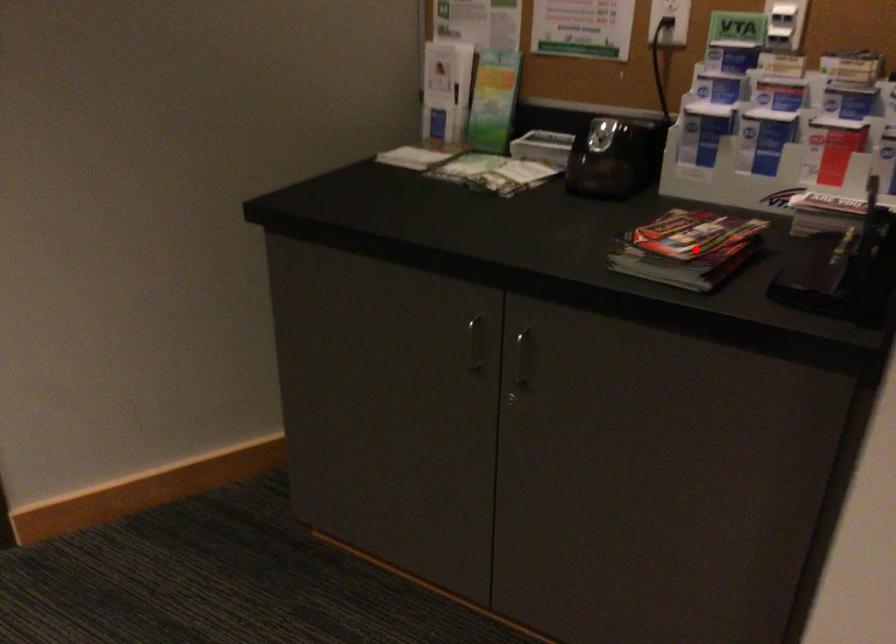
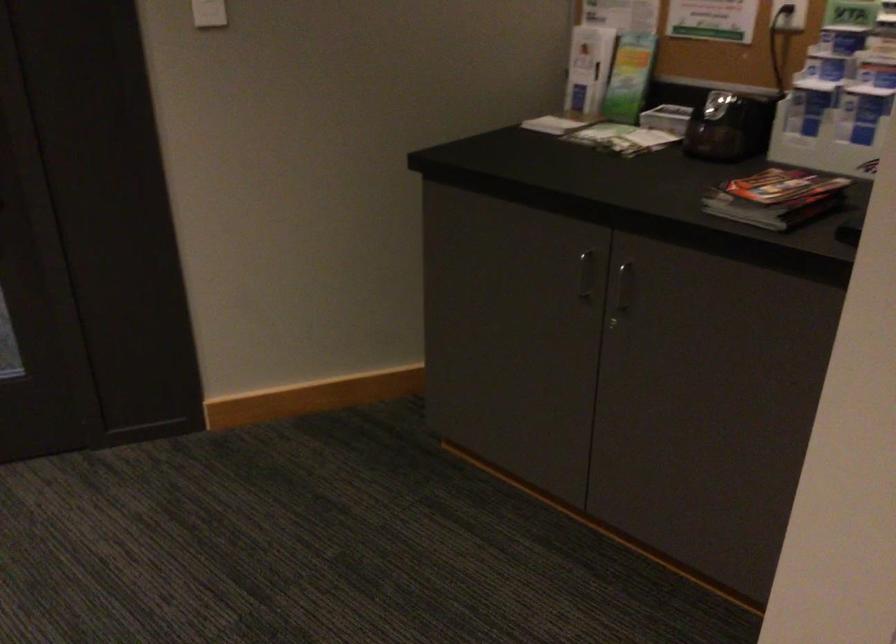
Find the pixel in the second image that matches the highlighted location in the first image.

(776, 198)